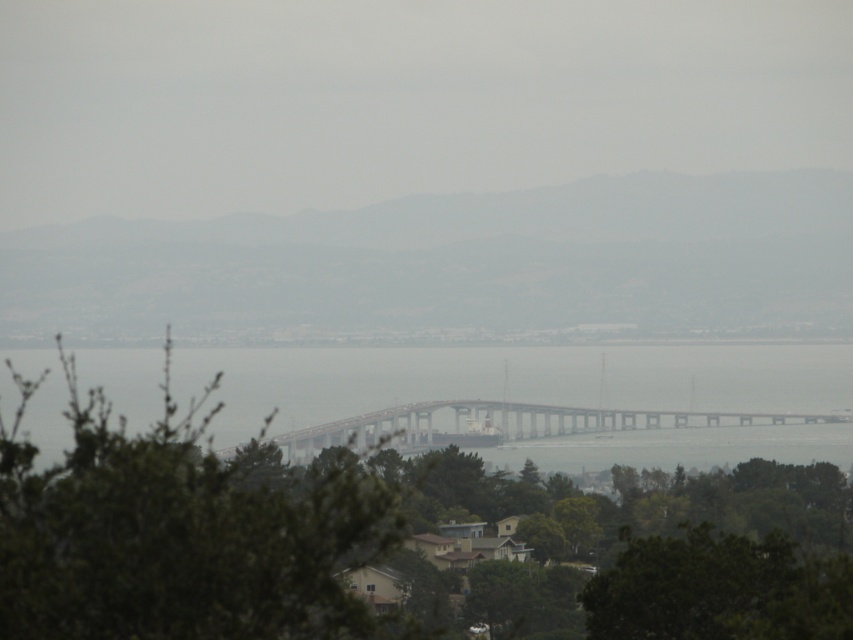
You are a GUI agent. You are given a task and a screenshot of the screen. Output one action in this format:
    pyautogui.click(x=<x>, y=<y>)
    Task: Click on the clear water at center
    The width and height of the screenshot is (853, 640).
    Given the screenshot: What is the action you would take?
    pyautogui.click(x=508, y=380)

Does clear water at center appear on the right side of metallic gray bridge at center?

No, clear water at center is not to the right of metallic gray bridge at center.

Between point (605, 440) and point (402, 410), which one is positioned in front?

Point (402, 410) is in front.

The height and width of the screenshot is (640, 853). What are the coordinates of `clear water at center` in the screenshot? It's located at (508, 380).

Identify the location of green leafy tree at center. This screenshot has width=853, height=640. (181, 532).

Between green leafy tree at center and metallic gray bridge at center, which one appears on the left side from the viewer's perspective?

From the viewer's perspective, green leafy tree at center appears more on the left side.

The height and width of the screenshot is (640, 853). Identify the location of green leafy tree at center. (181, 532).

Identify the location of green leafy tree at center. pyautogui.click(x=181, y=532).

Is point (13, 582) more distant than point (682, 435)?

No, it is not.

Is green leafy tree at center to the left of clear water at center from the viewer's perspective?

Indeed, green leafy tree at center is positioned on the left side of clear water at center.

Does point (326, 595) lie behind point (753, 369)?

That is False.

Find the location of a particular element. The height and width of the screenshot is (640, 853). green leafy tree at center is located at coordinates (181, 532).